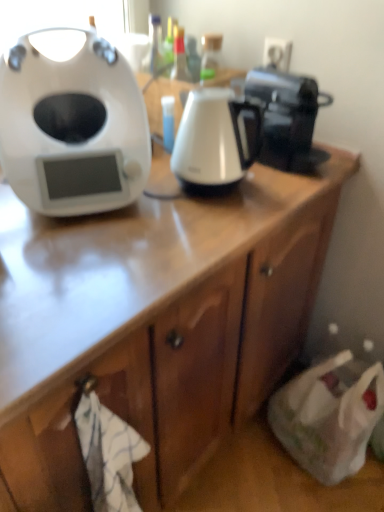
What do you see at coordinates (72, 124) in the screenshot?
I see `white matte/soft plastic at left` at bounding box center [72, 124].

Measure the distance between point (199, 123) and camera.

The depth of point (199, 123) is 36.26 inches.

What do you see at coordinates (287, 118) in the screenshot? I see `black glossy coffee maker at upper right` at bounding box center [287, 118].

At what (x,y) coordinates should I click in order to perform the action: click on white matte/soft plastic at left. Please return your answer as a coordinate pair (x, y). The height and width of the screenshot is (512, 384). Looking at the image, I should click on pyautogui.click(x=72, y=124).

Which is behind, point (239, 123) or point (128, 137)?

Positioned behind is point (128, 137).

You are a GUI agent. You are given a task and a screenshot of the screen. Output one action in this format:
    pyautogui.click(x=<x>, y=<y>)
    Task: Click on the kitchen appliance below the white matte/soft plastic at left (from the image's perspective)
    This screenshot has width=384, height=512.
    Given the screenshot: What is the action you would take?
    pyautogui.click(x=215, y=139)

Is white glossy electric kettle at center far from white matte/soft plastic at left?

No, white glossy electric kettle at center is not far away from white matte/soft plastic at left.

Is the depth of white glossy electric kettle at center less than that of white matte/soft plastic at left?

No, it is not.

Considering the sizes of objects white glossy electric kettle at center and black glossy coffee maker at upper right in the image provided, who is thinner, white glossy electric kettle at center or black glossy coffee maker at upper right?

white glossy electric kettle at center.

Is white glossy electric kettle at center shorter than black glossy coffee maker at upper right?

No.

Is white glossy electric kettle at center surrounding black glossy coffee maker at upper right?

Definitely not — black glossy coffee maker at upper right is not inside white glossy electric kettle at center.

Are white glossy electric kettle at center and black glossy coffee maker at upper right making contact?

white glossy electric kettle at center and black glossy coffee maker at upper right are clearly separated.

Is white glossy electric kettle at center completely or partially inside white matte/soft plastic at left?

No, white glossy electric kettle at center is not inside white matte/soft plastic at left.

Is point (47, 109) farther from camera compared to point (210, 113)?

Yes, it is.

From a real-world perspective, which is physically below, white matte/soft plastic at left or white glossy electric kettle at center?

white glossy electric kettle at center is physically lower.

Does white matte/soft plastic at left appear on the left side of black glossy coffee maker at upper right?

→ Yes, white matte/soft plastic at left is to the left of black glossy coffee maker at upper right.

Which of these two, white matte/soft plastic at left or black glossy coffee maker at upper right, stands shorter?

black glossy coffee maker at upper right is shorter.

There is a black glossy coffee maker at upper right. Find the location of `home appliance above it (from a real-world perspective)`. home appliance above it (from a real-world perspective) is located at coordinates (72, 124).

Is white matte/soft plastic at left positioned far away from black glossy coffee maker at upper right?

No.

Between black glossy coffee maker at upper right and white glossy electric kettle at center, which one has smaller size?

white glossy electric kettle at center is smaller.

From a real-world perspective, does black glossy coffee maker at upper right stand above white glossy electric kettle at center?

Indeed, from a real-world perspective, black glossy coffee maker at upper right stands above white glossy electric kettle at center.

From the image's perspective, which is above, black glossy coffee maker at upper right or white glossy electric kettle at center?

black glossy coffee maker at upper right is shown above in the image.

Is black glossy coffee maker at upper right wider or thinner than white glossy electric kettle at center?

Clearly, black glossy coffee maker at upper right has more width compared to white glossy electric kettle at center.

Is black glossy coffee maker at upper right taller or shorter than white matte/soft plastic at left?

Considering their sizes, black glossy coffee maker at upper right has less height than white matte/soft plastic at left.

From the image's perspective, is black glossy coffee maker at upper right located above or below white matte/soft plastic at left?

Based on their image positions, black glossy coffee maker at upper right is located above white matte/soft plastic at left.

This screenshot has width=384, height=512. I want to click on home appliance on the left of black glossy coffee maker at upper right, so click(72, 124).

From a real-world perspective, is black glossy coffee maker at upper right located higher than white matte/soft plastic at left?

Actually, black glossy coffee maker at upper right is physically below white matte/soft plastic at left in the real world.

This screenshot has width=384, height=512. Find the location of `kitchen appliance that appears below the white matte/soft plastic at left (from a real-world perspective)`. kitchen appliance that appears below the white matte/soft plastic at left (from a real-world perspective) is located at coordinates (215, 139).

Locate an element on the screen. The image size is (384, 512). kitchen appliance in front of the black glossy coffee maker at upper right is located at coordinates [215, 139].

Considering their positions, is white glossy electric kettle at center positioned further to black glossy coffee maker at upper right than white matte/soft plastic at left?

white matte/soft plastic at left is further to black glossy coffee maker at upper right.

Looking at this image, estimate the real-world distances between objects in this image. Which object is closer to white matte/soft plastic at left, white glossy electric kettle at center or black glossy coffee maker at upper right?

white glossy electric kettle at center is closer to white matte/soft plastic at left.

Which object lies further to the anchor point white glossy electric kettle at center, white matte/soft plastic at left or black glossy coffee maker at upper right?

Among the two, white matte/soft plastic at left is located further to white glossy electric kettle at center.

Considering their positions, is white matte/soft plastic at left positioned further to black glossy coffee maker at upper right than white glossy electric kettle at center?

white matte/soft plastic at left lies further to black glossy coffee maker at upper right than the other object.

Based on their spatial positions, is black glossy coffee maker at upper right or white matte/soft plastic at left closer to white glossy electric kettle at center?

black glossy coffee maker at upper right is closer to white glossy electric kettle at center.

From the image, which object appears to be nearer to white matte/soft plastic at left, black glossy coffee maker at upper right or white glossy electric kettle at center?

Among the two, white glossy electric kettle at center is located nearer to white matte/soft plastic at left.

Identify the location of kitchen appliance located between white matte/soft plastic at left and black glossy coffee maker at upper right in the left-right direction. Image resolution: width=384 pixels, height=512 pixels. (215, 139).